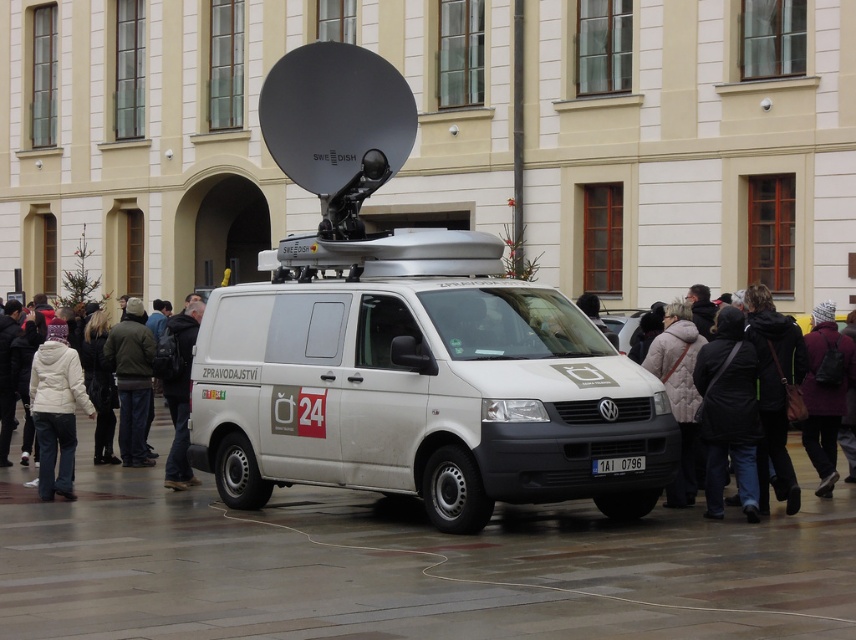
Question: Among these points, which one is nearest to the camera?

Choices:
 (A) (723, 404)
 (B) (847, 339)

Answer: (A)

Question: Is dark brown leather jacket at left wider than black leather jacket at center?

Choices:
 (A) yes
 (B) no

Answer: (A)

Question: Does white matte van at center appear over white fleece jacket at left?

Choices:
 (A) no
 (B) yes

Answer: (B)

Question: Estimate the real-world distances between objects in this image. Which object is closer to the black leather jacket at lower right?

Choices:
 (A) black leather jacket at center
 (B) dark brown leather jacket at left

Answer: (A)

Question: Which object is closer to the camera taking this photo?

Choices:
 (A) dark brown leather jacket at left
 (B) black leather jacket at lower right
 (C) black fabric jacket at lower right

Answer: (B)

Question: Does dark brown leather jacket at left have a larger size compared to black leather jacket at center?

Choices:
 (A) no
 (B) yes

Answer: (B)